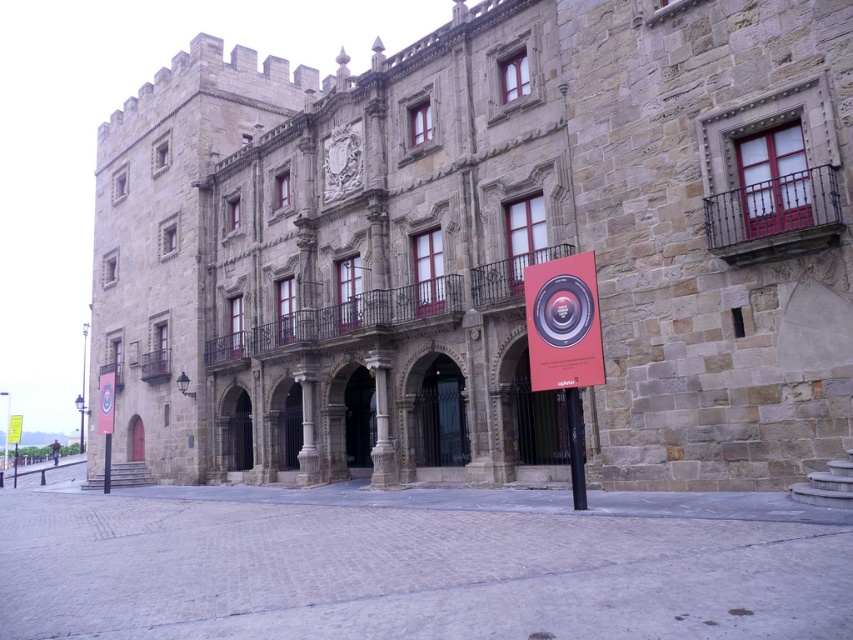
You are a visitor standing in front of the grand stone building. You see a matte red poster at center and a black metal pole at center. Which object is higher up in the scene?

The matte red poster at center is positioned over the black metal pole at center, so it is higher up in the scene.

What are the coordinates of the matte red poster at center?

The coordinates of the matte red poster at center are 0.506 in the x direction and 0.661 in the y direction.